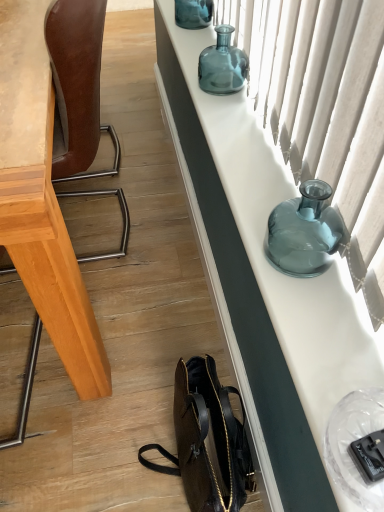
I want to click on free location in front of translucent glass vase at upper right, acting as the third bottle starting from the back, so click(323, 322).